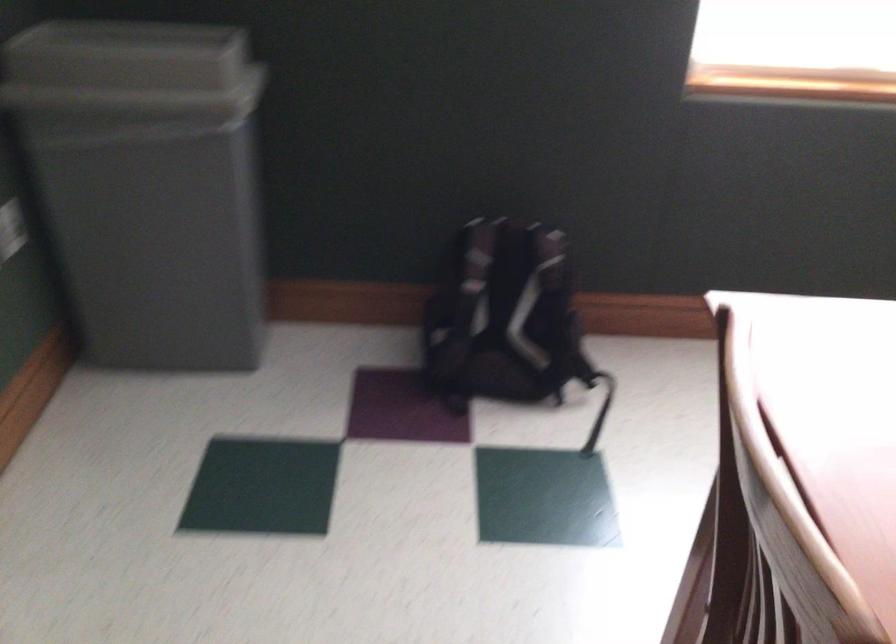
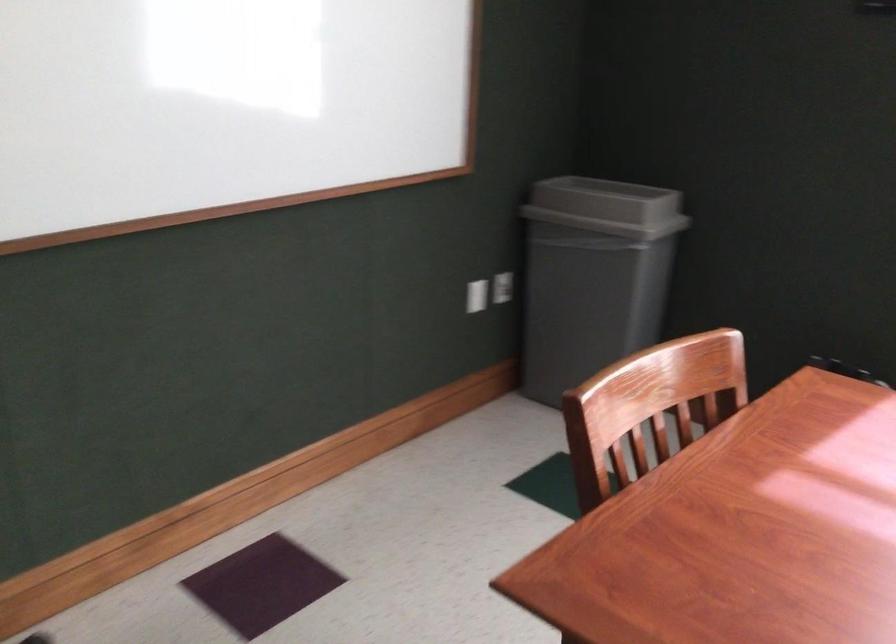
Locate, in the second image, the point that corresponds to the point at 171,71 in the first image.

(607, 207)